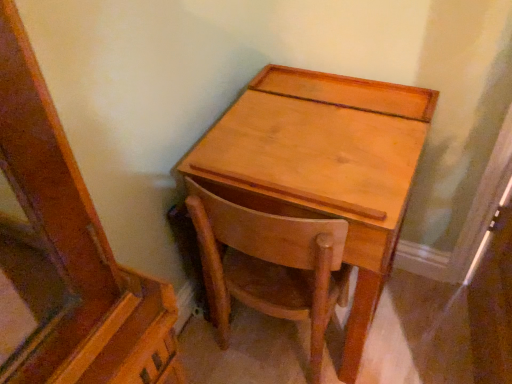
Find the location of a particular element. This screenshot has width=512, height=384. vacant point above light brown wood chair at center (from a real-world perspective) is located at coordinates (280, 186).